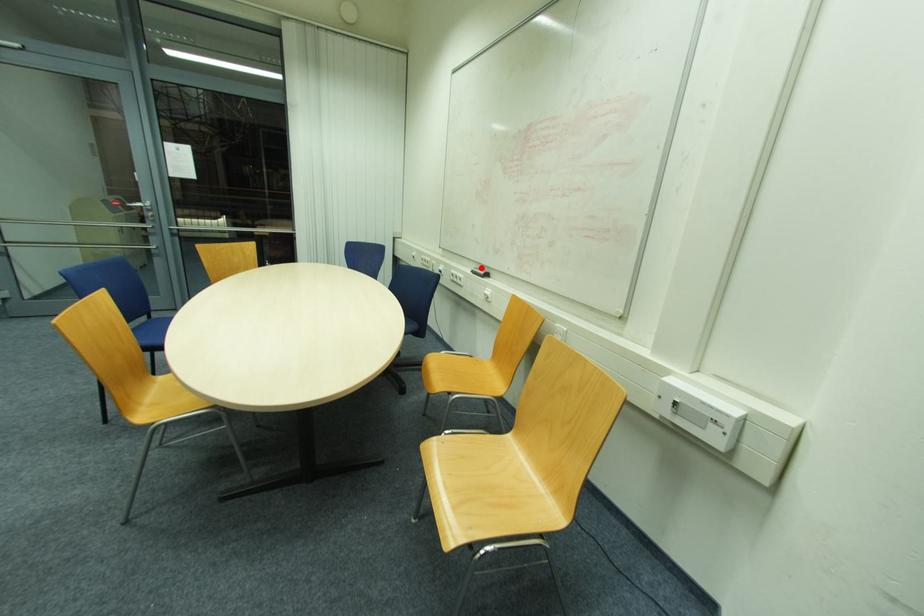
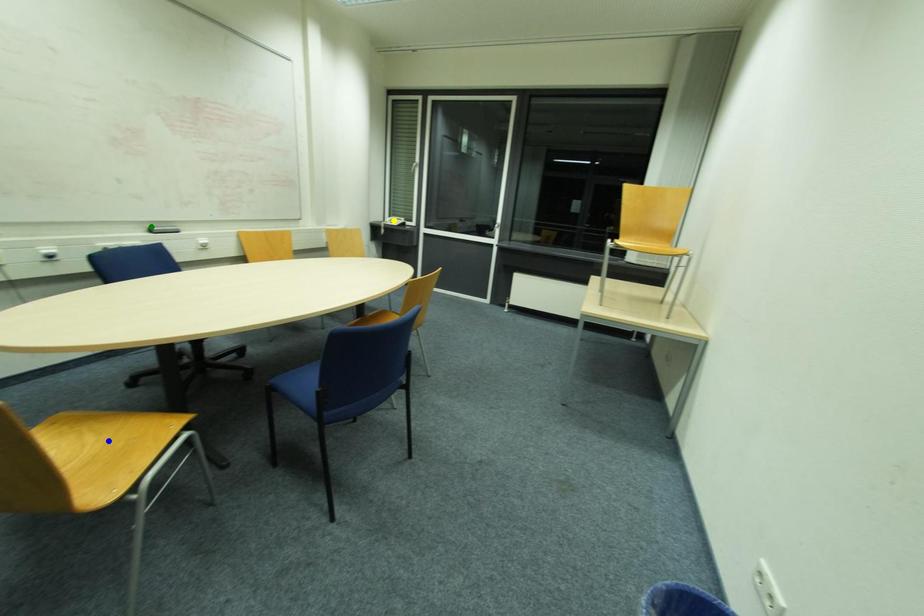
Question: I am providing you with two images of the same scene from different viewpoints. A red point is marked on the first image. You are given multiple points on the second image. Which point in image 2 represents the same 3d spot as the red point in image 1?

Choices:
 (A) blue point
 (B) yellow point
 (C) green point

Answer: (C)